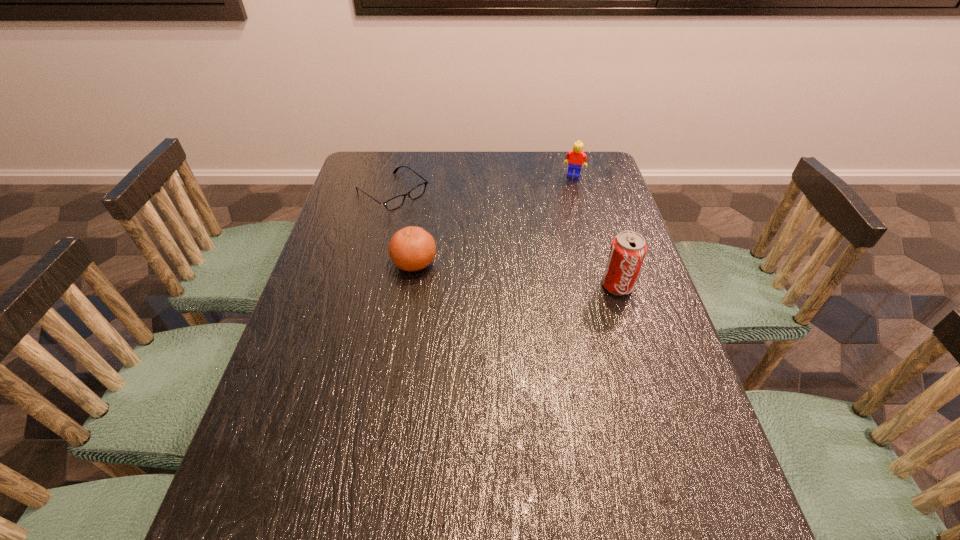
The image size is (960, 540). I want to click on the second shortest object, so click(x=412, y=248).

Identify the location of soda can. The image size is (960, 540). (628, 249).

The width and height of the screenshot is (960, 540). I want to click on Lego, so click(576, 157).

Find the location of `spectacles`. spectacles is located at coordinates (397, 201).

Identify the location of vacant space located 0.140m on the back of the clementine. Image resolution: width=960 pixels, height=540 pixels. [420, 218].

Locate an element on the screen. free region located 0.390m on the front of the tallest object is located at coordinates (666, 448).

The height and width of the screenshot is (540, 960). What are the coordinates of `vacant space located on the front-facing side of the Lego` in the screenshot? It's located at (566, 191).

Locate an element on the screen. free region located on the front-facing side of the Lego is located at coordinates (554, 229).

I want to click on vacant space located 0.060m on the front-facing side of the Lego, so [567, 187].

At what (x,y) coordinates should I click in order to perform the action: click on vacant region located on the front-facing side of the shortest object. Please return your answer as a coordinate pair (x, y). This screenshot has height=540, width=960. Looking at the image, I should click on (506, 269).